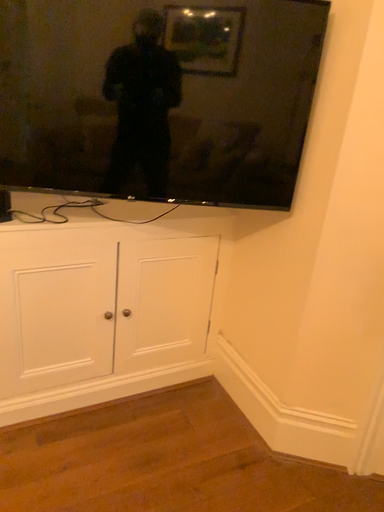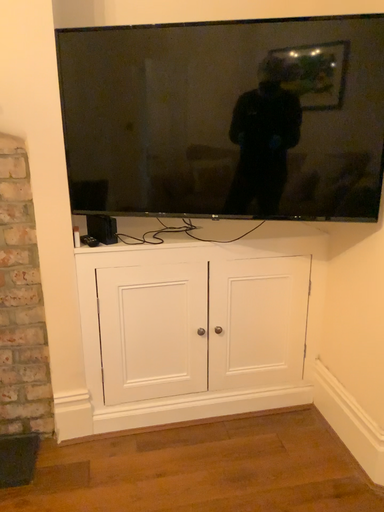
Question: How did the camera likely rotate when shooting the video?

Choices:
 (A) rotated right
 (B) rotated left

Answer: (B)